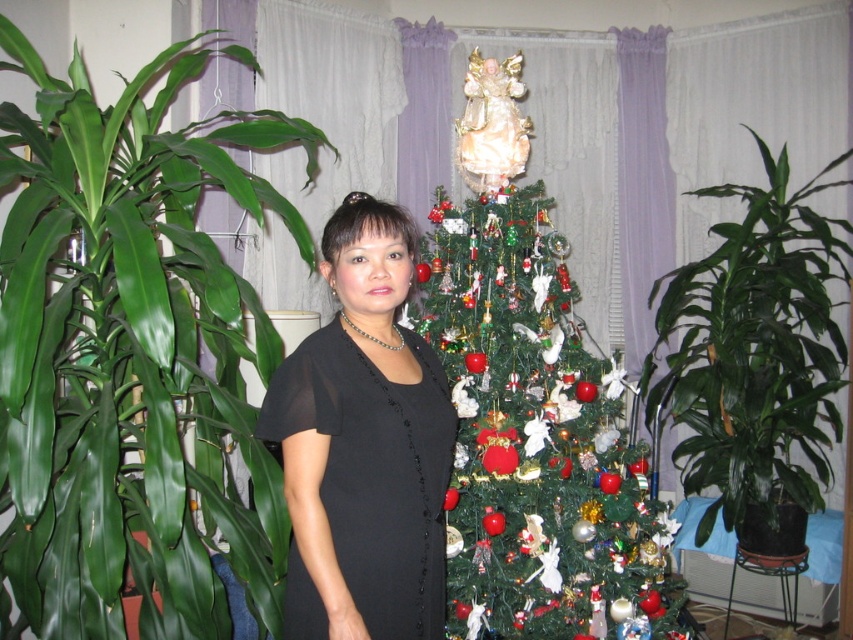
Question: Among these points, which one is farthest from the camera?

Choices:
 (A) (477, 269)
 (B) (276, 378)
 (C) (57, 188)
 (D) (827, 440)

Answer: (D)

Question: Can you confirm if green glossy leafy plant at left is positioned to the left of black sheer dress at center?

Choices:
 (A) yes
 (B) no

Answer: (A)

Question: Considering the relative positions of green matte christmas tree at center and green leafy plant at center in the image provided, where is green matte christmas tree at center located with respect to green leafy plant at center?

Choices:
 (A) right
 (B) left

Answer: (B)

Question: Which point is closer to the camera taking this photo?

Choices:
 (A) (537, 220)
 (B) (111, 166)

Answer: (B)

Question: From the image, what is the correct spatial relationship of green matte christmas tree at center in relation to green leafy plant at center?

Choices:
 (A) above
 (B) below

Answer: (B)

Question: Among these objects, which one is farthest from the camera?

Choices:
 (A) green matte christmas tree at center
 (B) black sheer dress at center
 (C) green glossy leafy plant at left
 (D) green leafy plant at center

Answer: (D)